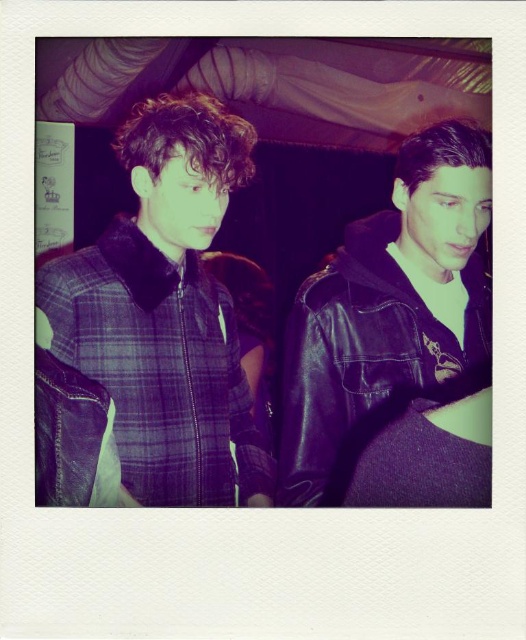
Question: Which of the following is the closest to the observer?

Choices:
 (A) plaid fabric jacket at left
 (B) black leather jacket at right

Answer: (B)

Question: Is plaid fabric jacket at left smaller than black leather jacket at right?

Choices:
 (A) no
 (B) yes

Answer: (B)

Question: Is plaid fabric jacket at left below black leather jacket at right?

Choices:
 (A) yes
 (B) no

Answer: (B)

Question: Can you confirm if plaid fabric jacket at left is wider than black leather jacket at right?

Choices:
 (A) yes
 (B) no

Answer: (B)